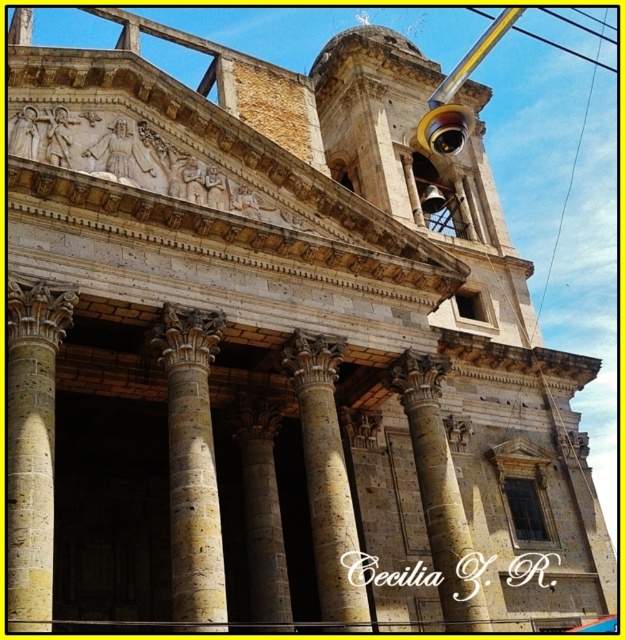
Question: Is stone column at left to the right of stone textured column at center from the viewer's perspective?

Choices:
 (A) no
 (B) yes

Answer: (A)

Question: Can you confirm if yellow stone column at center is smaller than marble column at center?

Choices:
 (A) no
 (B) yes

Answer: (A)

Question: Does stone column at left have a larger size compared to stone textured column at center?

Choices:
 (A) no
 (B) yes

Answer: (B)

Question: Which object appears closest to the camera in this image?

Choices:
 (A) brown stone column at center
 (B) marble column at center
 (C) stone textured column at center

Answer: (B)

Question: Based on their relative distances, which object is nearer to the stone column at left?

Choices:
 (A) stone textured column at center
 (B) yellow stone column at center

Answer: (B)

Question: Which point is farther to the camera?

Choices:
 (A) yellow stone column at center
 (B) brown stone column at center

Answer: (B)